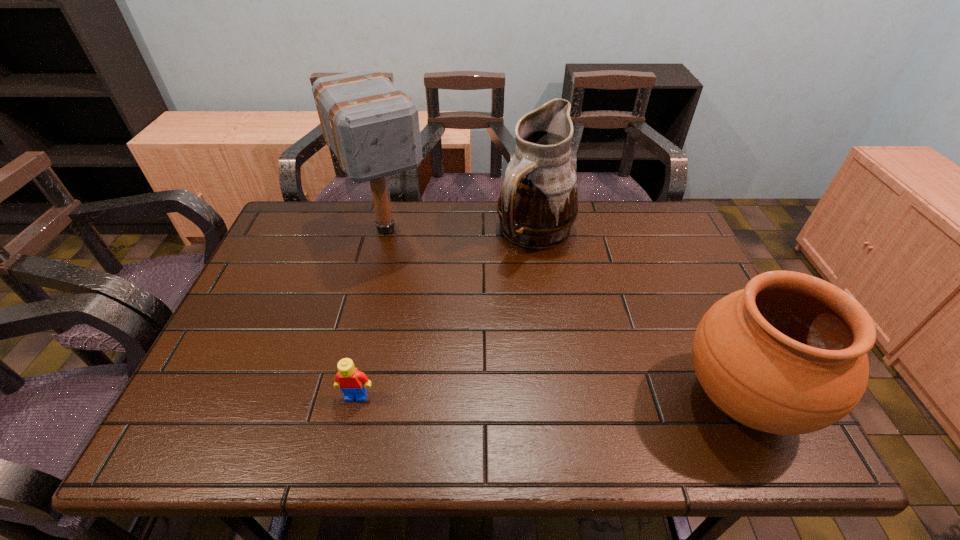
You are a GUI agent. You are given a task and a screenshot of the screen. Output one action in this format:
    pyautogui.click(x=<x>, y=<y>)
    Task: Click on the Lego
    This screenshot has width=960, height=540.
    Given the screenshot: What is the action you would take?
    pyautogui.click(x=351, y=381)

You are a GUI agent. You are given a task and a screenshot of the screen. Output one action in this format:
    pyautogui.click(x=<x>, y=<y>)
    Task: Click on the third tallest object
    
    Given the screenshot: What is the action you would take?
    pyautogui.click(x=787, y=355)

The image size is (960, 540). Find the location of `pottery`. pottery is located at coordinates (787, 355).

At what (x,y) coordinates should I click in order to perform the action: click on pitcher. Please return your answer as a coordinate pair (x, y). The width and height of the screenshot is (960, 540). Looking at the image, I should click on (538, 203).

In order to click on the third shortest object in this screenshot , I will do `click(538, 203)`.

You are a GUI agent. You are given a task and a screenshot of the screen. Output one action in this format:
    pyautogui.click(x=<x>, y=<y>)
    Task: Click on the mallet
    The image size is (960, 540).
    Given the screenshot: What is the action you would take?
    pyautogui.click(x=373, y=128)

This screenshot has width=960, height=540. In order to click on blank space located 0.060m on the left of the rightmost object in this screenshot , I will do `click(649, 399)`.

What are the coordinates of `vacant point located 0.230m from the spout of the pitcher` in the screenshot? It's located at (557, 325).

Locate an element on the screen. The height and width of the screenshot is (540, 960). free space located 0.160m from the spout of the pitcher is located at coordinates (552, 305).

Where is `blank space located 0.060m from the spout of the pitcher`? The image size is (960, 540). blank space located 0.060m from the spout of the pitcher is located at coordinates click(x=546, y=278).